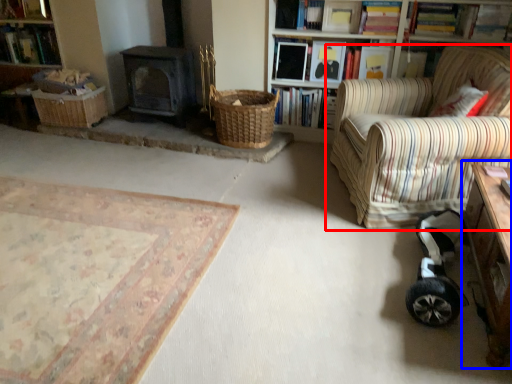
Question: Which object is further to the camera taking this photo, chair (highlighted by a red box) or table (highlighted by a blue box)?

Choices:
 (A) chair
 (B) table

Answer: (A)